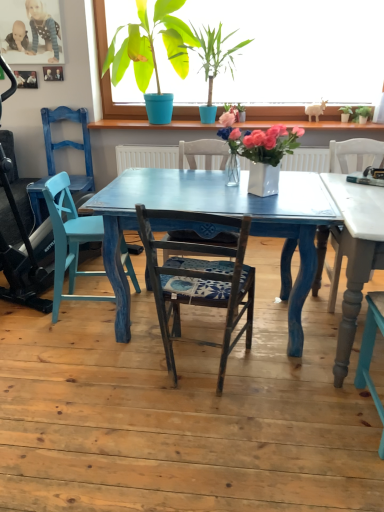
Find the location of `matte blue chair at left`. matte blue chair at left is located at coordinates (59, 148).

You are a GUI agent. You are given a task and a screenshot of the screen. Output one action in this format:
    pyautogui.click(x=<x>, y=<y>)
    Task: Click on the green leafy plant at upper center, which is counted as the fifth houseplant, starting from the left
    
    Given the screenshot: What is the action you would take?
    pyautogui.click(x=363, y=114)

Describe the element at coordinates (263, 153) in the screenshot. I see `white ceramic vase at center, the third houseplant in the left-to-right sequence` at that location.

Find the location of a particular element. The width and height of the screenshot is (384, 512). green matte plant at upper center, the second houseplant viewed from the left is located at coordinates (216, 54).

Find the location of a particular element. blue dotted dress at upper left is located at coordinates (42, 29).

From the matte blue chair at left, count 2nd houseplant to the right and point to it. Please provide its 2D coordinates.

[(216, 54)]

Would you say green matte plant at upper center, the second houseplant viewed from the left, is outside matte blue chair at left?

Yes, green matte plant at upper center, the second houseplant viewed from the left, is not within matte blue chair at left.

From the image's perspective, is green matte plant at upper center, the second houseplant viewed from the left, under matte blue chair at left?

Incorrect, from the image's perspective, green matte plant at upper center, the second houseplant viewed from the left, is higher than matte blue chair at left.

From a real-world perspective, is green matte plant at upper center, the second houseplant viewed from the left, positioned over matte blue chair at left based on gravity?

Yes, from a real-world perspective, green matte plant at upper center, the second houseplant viewed from the left, is on top of matte blue chair at left.

From their relative heights in the image, would you say white ceramic vase at center, the third houseplant in the left-to-right sequence, is taller or shorter than green matte plant at upper center, the 5th houseplant from the right?

In the image, white ceramic vase at center, the third houseplant in the left-to-right sequence, appears to be shorter than green matte plant at upper center, the 5th houseplant from the right.

You are a GUI agent. You are given a task and a screenshot of the screen. Output one action in this format:
    pyautogui.click(x=<x>, y=<y>)
    Task: Click on the 2nd houseplant behind the white ceramic vase at center, the third houseplant positioned from the right
    This screenshot has height=512, width=384.
    Given the screenshot: What is the action you would take?
    pyautogui.click(x=146, y=44)

From a real-world perspective, who is located lower, white ceramic vase at center, the third houseplant in the left-to-right sequence, or green matte plant at upper center, placed as the first houseplant when sorted from left to right?

white ceramic vase at center, the third houseplant in the left-to-right sequence.

How many degrees apart are the facing directions of white ceramic vase at center, the third houseplant in the left-to-right sequence, and green matte plant at upper center, placed as the first houseplant when sorted from left to right?

41.3 degrees separate the facing orientations of white ceramic vase at center, the third houseplant in the left-to-right sequence, and green matte plant at upper center, placed as the first houseplant when sorted from left to right.

Is blue dotted dress at upper left oriented towards green matte plant at upper center, acting as the fourth houseplant starting from the right?

No.

Does blue dotted dress at upper left have a lesser width compared to green matte plant at upper center, the second houseplant viewed from the left?

Indeed, blue dotted dress at upper left has a lesser width compared to green matte plant at upper center, the second houseplant viewed from the left.

Considering the relative positions of blue dotted dress at upper left and green matte plant at upper center, the second houseplant viewed from the left, in the image provided, is blue dotted dress at upper left to the right of green matte plant at upper center, the second houseplant viewed from the left, from the viewer's perspective?

Incorrect, blue dotted dress at upper left is not on the right side of green matte plant at upper center, the second houseplant viewed from the left.

Is green matte plant at upper right, marked as the second houseplant in a right-to-left arrangement, oriented away from wooden chair with cushion at center?

No.

Is green matte plant at upper right, which is the 4th houseplant from left to right, next to wooden chair with cushion at center?

There is a gap between green matte plant at upper right, which is the 4th houseplant from left to right, and wooden chair with cushion at center.

Does point (341, 111) appear closer or farther from the camera than point (199, 296)?

Clearly, point (341, 111) is more distant from the camera than point (199, 296).

Considering the sizes of objects green matte plant at upper right, which is the 4th houseplant from left to right, and wooden chair with cushion at center in the image provided, who is shorter, green matte plant at upper right, which is the 4th houseplant from left to right, or wooden chair with cushion at center?

Standing shorter between the two is green matte plant at upper right, which is the 4th houseplant from left to right.

Which of these two, wooden picture frame at upper left or green matte plant at upper right, which is the 4th houseplant from left to right, is wider?

green matte plant at upper right, which is the 4th houseplant from left to right.

Locate an element on the screen. This screenshot has height=512, width=384. picture frame above the green matte plant at upper right, which is the 4th houseplant from left to right (from the image's perspective) is located at coordinates (53, 73).

Is wooden picture frame at upper left inside the boundaries of green matte plant at upper right, which is the 4th houseplant from left to right, or outside?

wooden picture frame at upper left is located beyond the bounds of green matte plant at upper right, which is the 4th houseplant from left to right.

In terms of width, does green matte plant at upper right, marked as the second houseplant in a right-to-left arrangement, look wider or thinner when compared to green matte plant at upper center, the second houseplant viewed from the left?

In the image, green matte plant at upper right, marked as the second houseplant in a right-to-left arrangement, appears to be more narrow than green matte plant at upper center, the second houseplant viewed from the left.

Between green matte plant at upper right, marked as the second houseplant in a right-to-left arrangement, and green matte plant at upper center, acting as the fourth houseplant starting from the right, which one has larger size?

With larger size is green matte plant at upper center, acting as the fourth houseplant starting from the right.

Considering the relative sizes of green matte plant at upper right, marked as the second houseplant in a right-to-left arrangement, and green matte plant at upper center, the second houseplant viewed from the left, in the image provided, is green matte plant at upper right, marked as the second houseplant in a right-to-left arrangement, shorter than green matte plant at upper center, the second houseplant viewed from the left,?

Yes, green matte plant at upper right, marked as the second houseplant in a right-to-left arrangement, is shorter than green matte plant at upper center, the second houseplant viewed from the left.

Is point (352, 113) farther from camera compared to point (212, 76)?

No, (352, 113) is closer to viewer.

From the picture: Could you tell me if wooden picture frame at upper left is turned towards matte blue swivel chair at left?

No, wooden picture frame at upper left does not turn towards matte blue swivel chair at left.

From a real-world perspective, who is located lower, wooden picture frame at upper left or matte blue swivel chair at left?

From a 3D spatial view, matte blue swivel chair at left is below.

Based on their positions, is wooden picture frame at upper left located to the left or right of matte blue swivel chair at left?

Based on their positions, wooden picture frame at upper left is located to the left of matte blue swivel chair at left.

At what (x,y) coordinates should I click in order to perform the action: click on swivel chair on the right of wooden picture frame at upper left. Please return your answer as a coordinate pair (x, y). Image resolution: width=384 pixels, height=512 pixels. Looking at the image, I should click on (69, 239).

From the image's perspective, count 3rd houseplants upward from the matte blue chair at left and point to it. Please provide its 2D coordinates.

[(216, 54)]

Find the location of a particular element. The width and height of the screenshot is (384, 512). houseplant that is the 4th object located below the green matte plant at upper center, placed as the first houseplant when sorted from left to right (from the image's perspective) is located at coordinates (263, 153).

Which object lies nearer to the anchor point matte blue chair at left, green leafy plant at upper center, which is counted as the first houseplant, starting from the right, or green matte plant at upper right, which is the 4th houseplant from left to right?

green matte plant at upper right, which is the 4th houseplant from left to right.

In the scene shown: From the image, which object appears to be farther from blue dotted dress at upper left, matte blue chair at left or green matte plant at upper right, which is the 4th houseplant from left to right?

green matte plant at upper right, which is the 4th houseplant from left to right, is positioned further to the anchor blue dotted dress at upper left.

Which object lies further to the anchor point blue dotted dress at upper left, matte blue chair at left or green matte plant at upper center, the second houseplant viewed from the left?

green matte plant at upper center, the second houseplant viewed from the left, is positioned further to the anchor blue dotted dress at upper left.

When comparing their distances from wooden chair with cushion at center, does green matte plant at upper right, which is the 4th houseplant from left to right, or matte blue chair at left seem closer?

matte blue chair at left lies closer to wooden chair with cushion at center than the other object.

Based on their spatial positions, is green matte plant at upper center, the second houseplant viewed from the left, or matte blue chair at left closer to blue dotted dress at upper left?

Based on the image, matte blue chair at left appears to be nearer to blue dotted dress at upper left.

Looking at this image, which object lies nearer to the anchor point green matte plant at upper center, the second houseplant viewed from the left, green matte plant at upper right, marked as the second houseplant in a right-to-left arrangement, or matte blue chair at left?

The object closer to green matte plant at upper center, the second houseplant viewed from the left, is green matte plant at upper right, marked as the second houseplant in a right-to-left arrangement.

Looking at the image, which one is located further to white ceramic vase at center, the third houseplant in the left-to-right sequence, wooden picture frame at upper left or blue dotted dress at upper left?

Based on the image, wooden picture frame at upper left appears to be further to white ceramic vase at center, the third houseplant in the left-to-right sequence.

Estimate the real-world distances between objects in this image. Which object is closer to green matte plant at upper center, the second houseplant viewed from the left, green matte plant at upper center, the 5th houseplant from the right, or green leafy plant at upper center, which is counted as the fifth houseplant, starting from the left?

green matte plant at upper center, the 5th houseplant from the right.

Identify the location of armchair between wooden chair with cushion at center and wooden picture frame at upper left from front to back. (59, 148).

Find the location of a particular element. The image size is (384, 512). chair located between matte blue chair at left and green matte plant at upper right, marked as the second houseplant in a right-to-left arrangement, in the left-right direction is located at coordinates (200, 280).

Where is `swivel chair that lies between green matte plant at upper center, the 5th houseplant from the right, and wooden chair with cushion at center from top to bottom`? Image resolution: width=384 pixels, height=512 pixels. swivel chair that lies between green matte plant at upper center, the 5th houseplant from the right, and wooden chair with cushion at center from top to bottom is located at coordinates (69, 239).

Where is `armchair situated between wooden picture frame at upper left and green matte plant at upper right, which is the 4th houseplant from left to right, from left to right`? armchair situated between wooden picture frame at upper left and green matte plant at upper right, which is the 4th houseplant from left to right, from left to right is located at coordinates (59, 148).